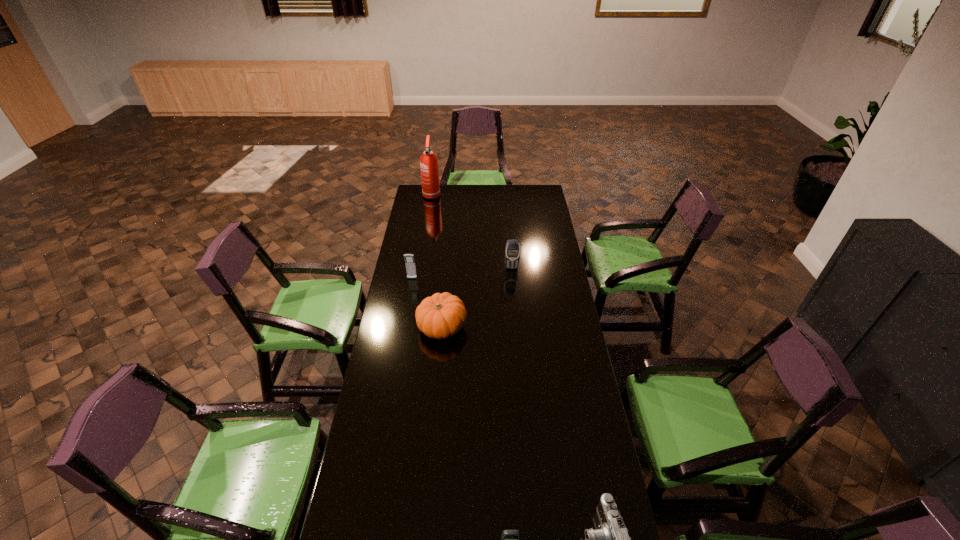
Find the location of `vacant space at the far right corner`. vacant space at the far right corner is located at coordinates (544, 191).

Identify the location of vacant area that lies between the farthest cellular telephone and the tallest object. The image size is (960, 540). (471, 231).

Find the location of a particular element. This screenshot has width=960, height=540. empty location between the second object from right to left and the fourth farthest object is located at coordinates (477, 298).

Find the location of a particular element. free space between the second farthest cellular telephone and the fifth nearest object is located at coordinates (462, 273).

The height and width of the screenshot is (540, 960). Identify the location of the fifth closest object relative to the leftmost cellular telephone. (510, 539).

Locate an element on the screen. This screenshot has height=540, width=960. object that can be found as the fifth closest to the second object from right to left is located at coordinates click(x=510, y=539).

Identify the location of the closest cellular telephone relative to the second shortest object. click(409, 258).

Select which cellular telephone appears as the third closest to the farthest object. Please provide its 2D coordinates. Your answer should be formatted as a tuple, i.e. [(x, y)], where the tuple contains the x and y coordinates of a point satisfying the conditions above.

[(510, 539)]